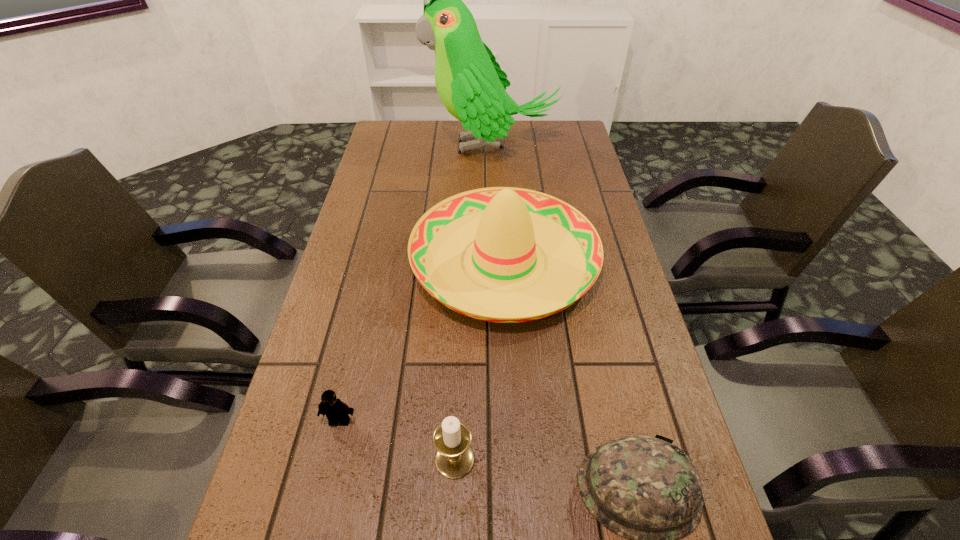
Identify the location of the farthest object. Image resolution: width=960 pixels, height=540 pixels. (470, 83).

Where is `the tallest object`? The width and height of the screenshot is (960, 540). the tallest object is located at coordinates (470, 83).

Identify the location of the second farthest object. (504, 281).

You are a GUI agent. You are given a task and a screenshot of the screen. Output one action in this format:
    pyautogui.click(x=<x>, y=<y>)
    Task: Click on the fourth shortest object
    
    Given the screenshot: What is the action you would take?
    pyautogui.click(x=504, y=281)

Locate an element on the screen. Image resolution: width=960 pixels, height=540 pixels. candle holder is located at coordinates (454, 458).

I want to click on Lego, so click(x=335, y=410).

This screenshot has height=540, width=960. I want to click on the third farthest object, so click(x=335, y=410).

Where is `free space located 0.120m on the beak of the farthest object`? This screenshot has width=960, height=540. free space located 0.120m on the beak of the farthest object is located at coordinates (393, 146).

Image resolution: width=960 pixels, height=540 pixels. I want to click on vacant space located 0.080m on the beak of the farthest object, so click(x=404, y=146).

At what (x,y) coordinates should I click in order to perform the action: click on vacant space located on the beak of the farthest object. Please return your answer as a coordinate pair (x, y). The image size is (960, 540). Looking at the image, I should click on (396, 146).